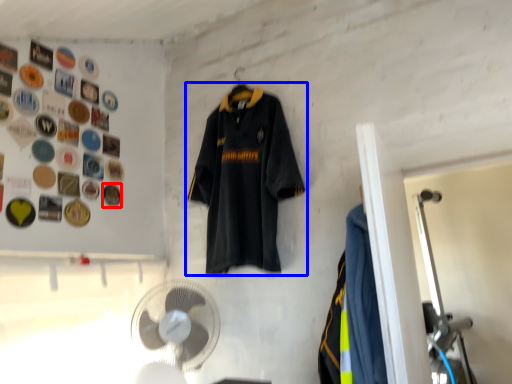
Question: Among these objects, which one is nearest to the camera, button (highlighted by a red box) or sports uniform (highlighted by a blue box)?

Choices:
 (A) button
 (B) sports uniform

Answer: (B)